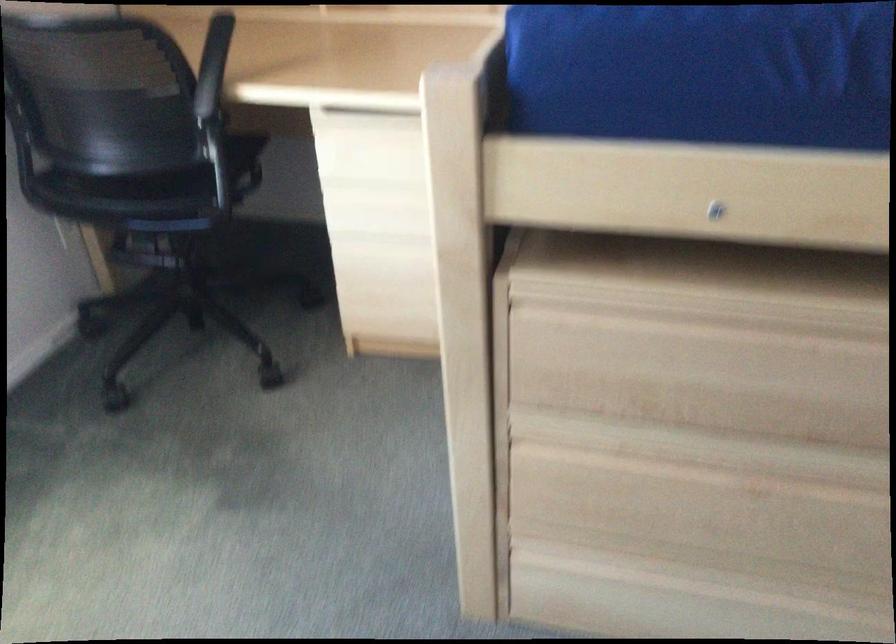
Identify the location of chair sitting surface. The height and width of the screenshot is (644, 896). (161, 182).